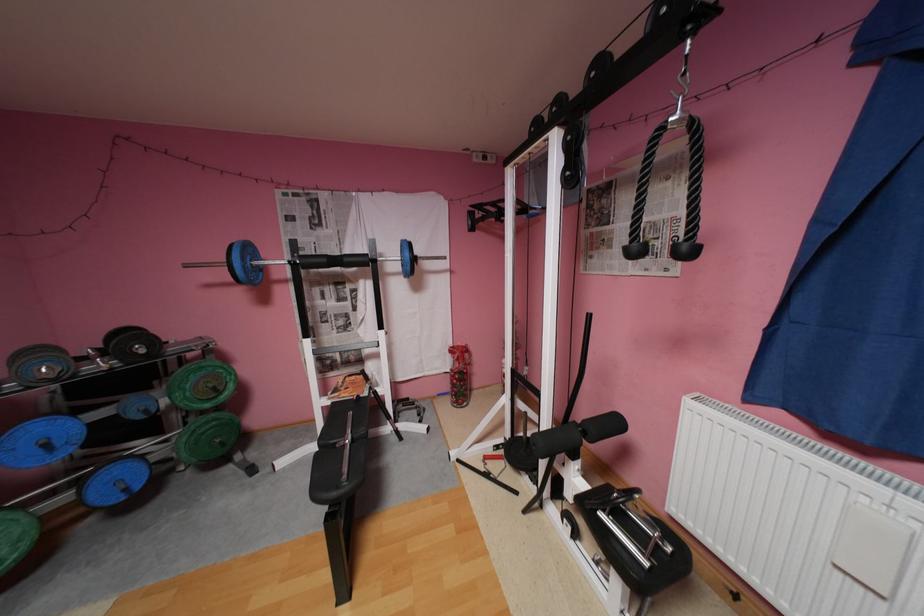
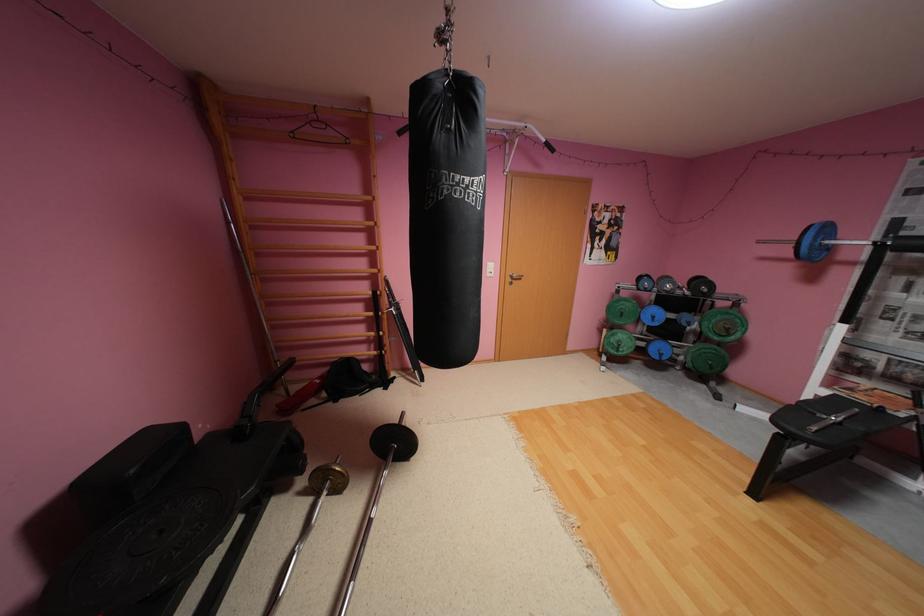
Find the pixel in the second image that matches (x=258, y=249) in the first image.

(835, 229)